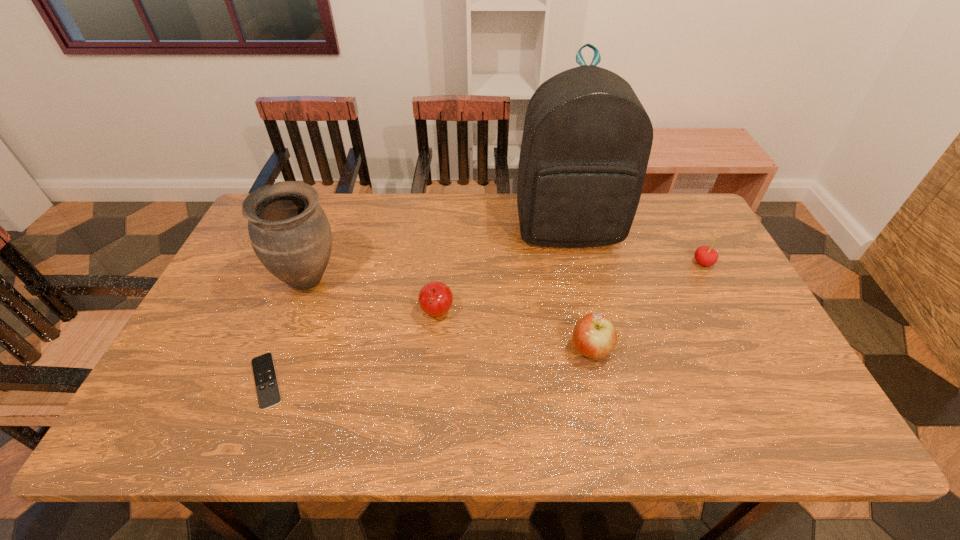
Find the location of a particular element. Image resolution: width=960 pixels, height=540 pixels. backpack is located at coordinates (587, 139).

Find the location of `the fifth shortest object`. the fifth shortest object is located at coordinates (290, 234).

This screenshot has width=960, height=540. In order to click on the right cherry in this screenshot , I will do `click(704, 255)`.

Image resolution: width=960 pixels, height=540 pixels. Identify the location of the farther cherry. (704, 255).

You are a GUI agent. You are given a task and a screenshot of the screen. Output one action in this format:
    pyautogui.click(x=<x>, y=<y>)
    Task: Click on the nearer cherry
    
    Given the screenshot: What is the action you would take?
    pyautogui.click(x=435, y=299)

The image size is (960, 540). I want to click on the left cherry, so click(x=435, y=299).

This screenshot has height=540, width=960. I want to click on apple, so click(594, 336).

The image size is (960, 540). I want to click on remote control, so click(268, 393).

Locate an element on the screen. The image size is (960, 540). vacant space situated 0.160m on the front-facing side of the backpack is located at coordinates (583, 296).

I want to click on free region located 0.310m on the right of the second tallest object, so click(451, 280).